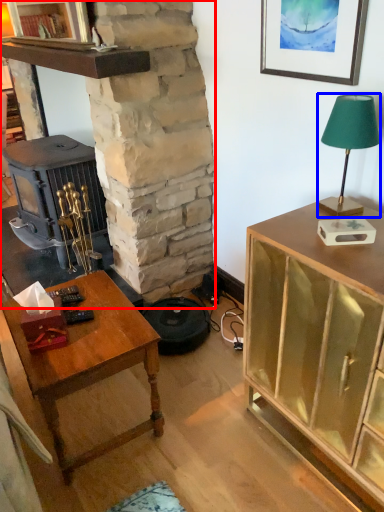
Question: Which object appears farthest to the camera in this image, fireplace (highlighted by a red box) or lamp (highlighted by a blue box)?

Choices:
 (A) fireplace
 (B) lamp

Answer: (A)